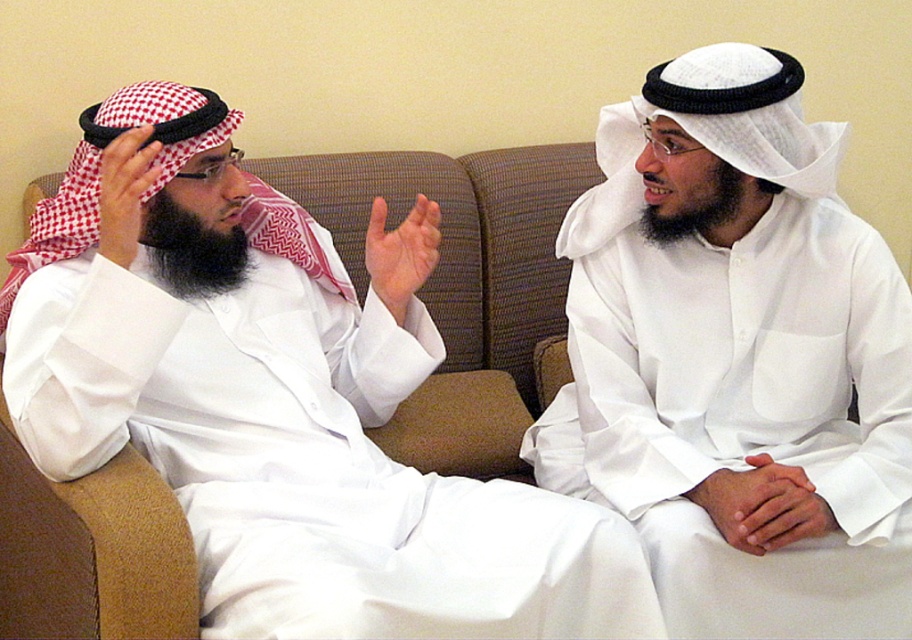
Which is in front, point (244, 284) or point (778, 483)?

Positioned in front is point (778, 483).

Is white matte/soft fabric at left in front of smooth white hands at center?

That is True.

Between point (151, 257) and point (798, 534), which one is positioned behind?

Positioned behind is point (151, 257).

Where is `white matte/soft fabric at left`? The image size is (912, 640). white matte/soft fabric at left is located at coordinates (278, 410).

Which is below, matte white hand at center or white checkered cloth at upper left?

matte white hand at center

Between point (374, 230) and point (110, 160), which one is positioned behind?

The point (374, 230) is more distant.

Does point (368, 243) come in front of point (158, 168)?

No.

Locate an element on the screen. The image size is (912, 640). matte white hand at center is located at coordinates (401, 252).

Is white matte/soft fabric at left above matte white hand at center?

No.

Is point (421, 376) more distant than point (434, 209)?

Yes, point (421, 376) is farther from viewer.

Locate an element on the screen. Image resolution: width=912 pixels, height=640 pixels. white matte/soft fabric at left is located at coordinates (278, 410).